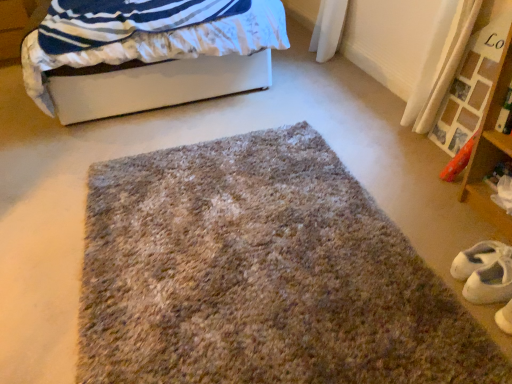
Identify the location of free space behind fuzzy carpet at center. Image resolution: width=512 pixels, height=384 pixels. (269, 112).